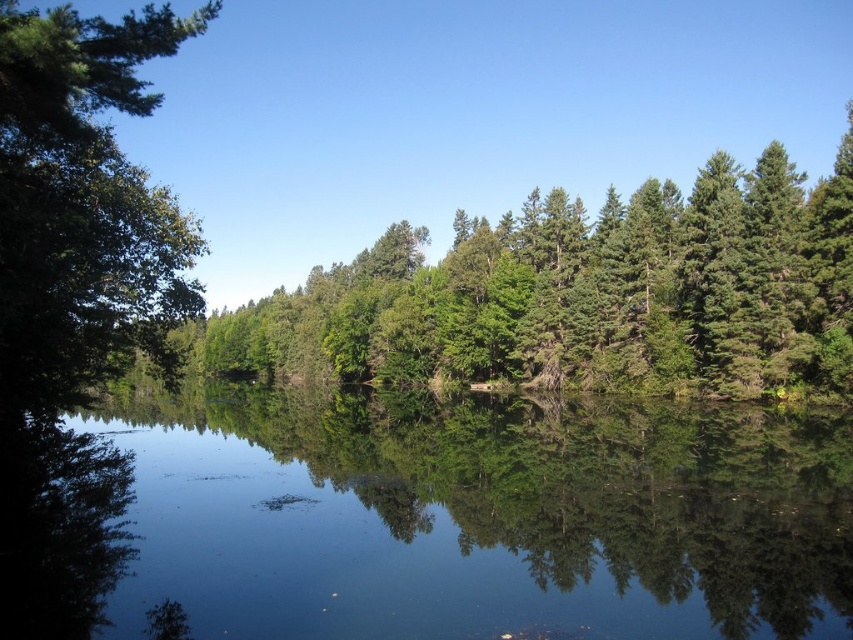
You are standing at the edge of a serene lake surrounded by dense coniferous trees. You notice a specific point marked at coordinates point (344, 401). Can you estimate how far this point is from your current position?

The distance between the viewer and point (344, 401) is 68.12 meters.

You are standing on the edge of the water and want to place a small floating decoration. The decoration requires a space that is wider than the transparent water at center. Can the green leafy tree at left provide enough space for this?

The transparent water at center is thinner than the green leafy tree at left, so the green leafy tree at left is wider. Therefore, the green leafy tree at left can provide enough space for the decoration that requires a wider area than the transparent water at center.